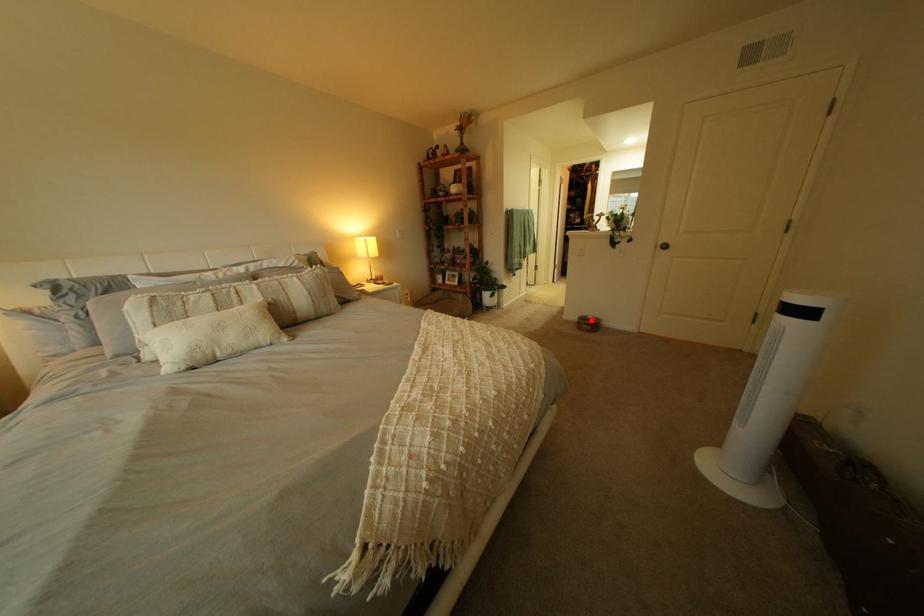
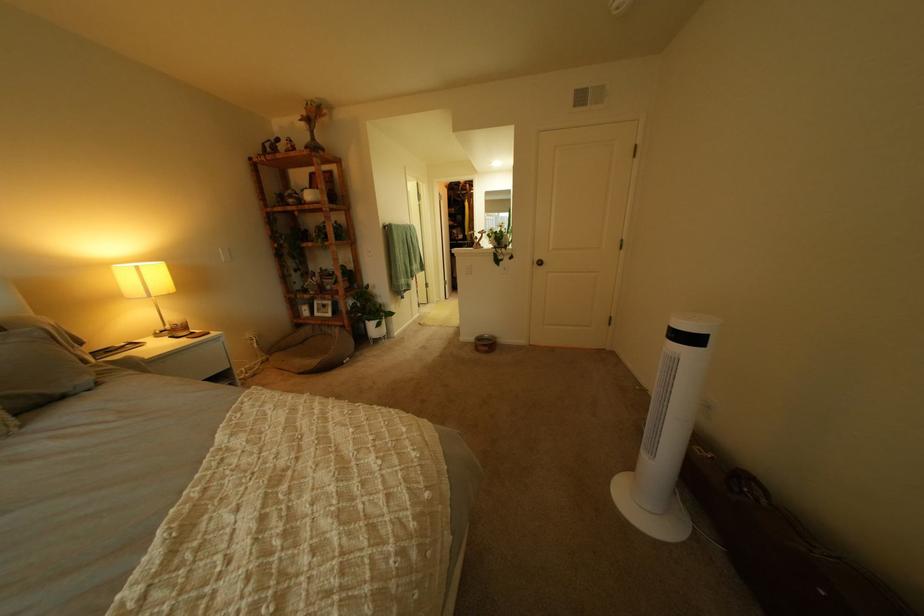
The point at the highlighted location is marked in the first image. Where is the corresponding point in the second image?

(489, 339)